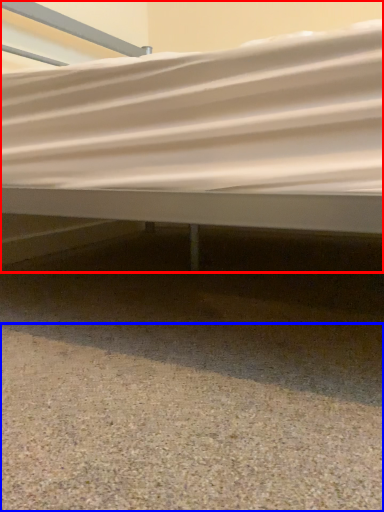
Question: Which of the following is the farthest to the observer, bed (highlighted by a red box) or gravel (highlighted by a blue box)?

Choices:
 (A) bed
 (B) gravel

Answer: (A)